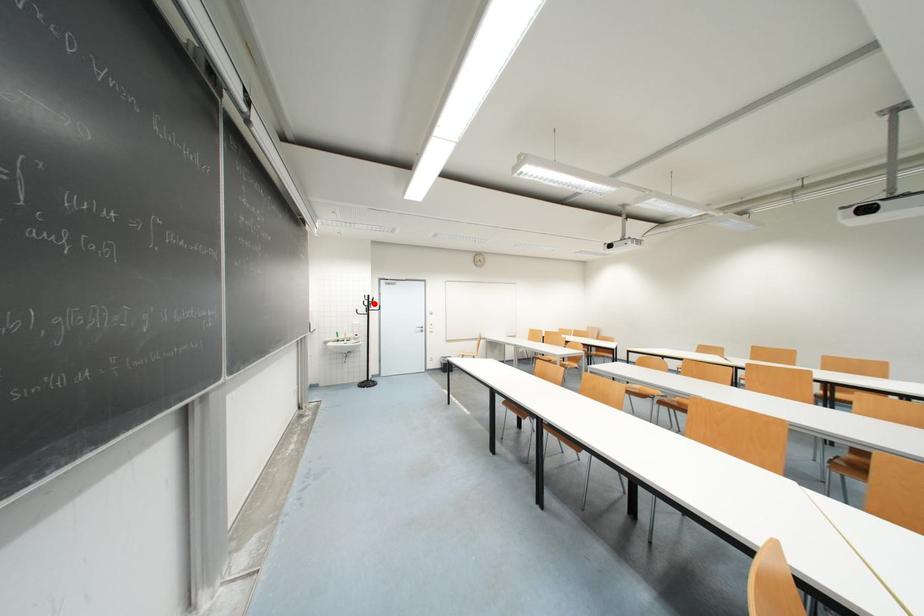
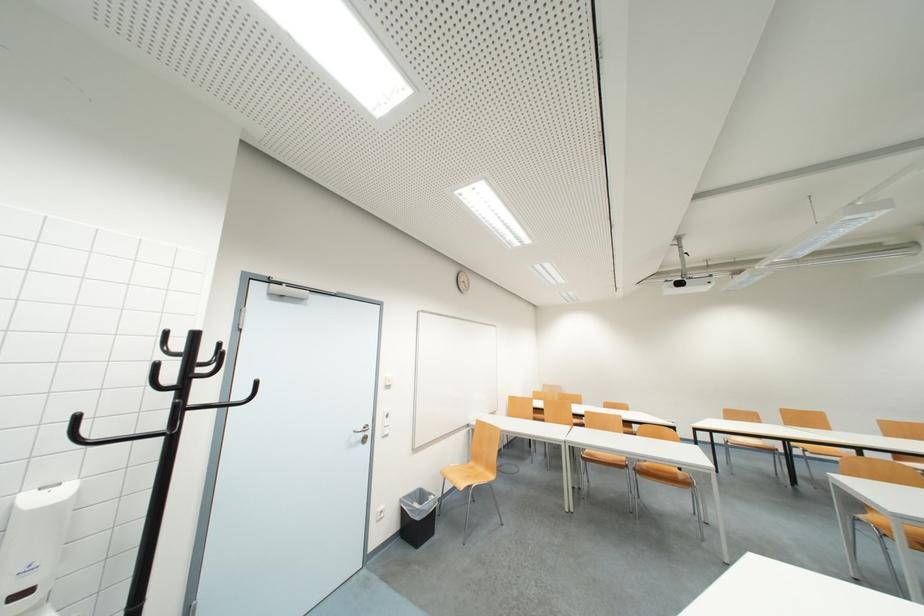
Find the pixel in the second image that matches the highlighted location in the first image.

(195, 367)